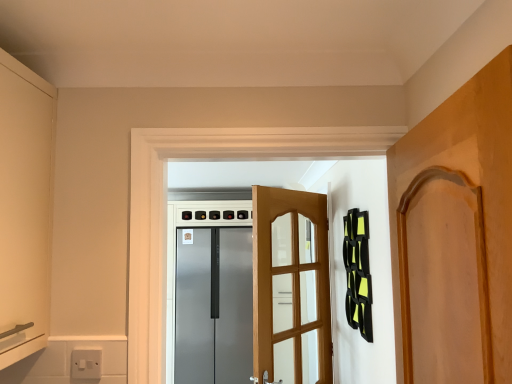
Question: Can you confirm if wooden door at center, positioned as the first door in back-to-front order, is taller than wooden door at right, which appears as the 1th door when viewed from the front?

Choices:
 (A) no
 (B) yes

Answer: (B)

Question: Is wooden door at center, the second door positioned from the front, at the left side of wooden door at right, which appears as the 1th door when viewed from the front?

Choices:
 (A) yes
 (B) no

Answer: (A)

Question: Is wooden door at center, positioned as the first door in back-to-front order, in contact with wooden door at right, the 2th door positioned from the back?

Choices:
 (A) yes
 (B) no

Answer: (B)

Question: Does wooden door at center, the second door positioned from the front, have a lesser width compared to wooden door at right, which appears as the 1th door when viewed from the front?

Choices:
 (A) yes
 (B) no

Answer: (A)

Question: From the image's perspective, is wooden door at center, the second door positioned from the front, beneath wooden door at right, the 2th door positioned from the back?

Choices:
 (A) no
 (B) yes

Answer: (B)

Question: From a real-world perspective, is satin silver refrigerator at center physically located above or below wooden door at right, which appears as the 1th door when viewed from the front?

Choices:
 (A) below
 (B) above

Answer: (A)

Question: Is satin silver refrigerator at center inside or outside of wooden door at right, which appears as the 1th door when viewed from the front?

Choices:
 (A) outside
 (B) inside

Answer: (A)

Question: In terms of width, does satin silver refrigerator at center look wider or thinner when compared to wooden door at right, the 2th door positioned from the back?

Choices:
 (A) wide
 (B) thin

Answer: (A)

Question: Is satin silver refrigerator at center taller or shorter than wooden door at right, which appears as the 1th door when viewed from the front?

Choices:
 (A) tall
 (B) short

Answer: (A)

Question: From a real-world perspective, is white plastic switch at lower left above or below wooden door at right, which appears as the 1th door when viewed from the front?

Choices:
 (A) below
 (B) above

Answer: (A)

Question: In the image, is white plastic switch at lower left positioned in front of or behind wooden door at right, which appears as the 1th door when viewed from the front?

Choices:
 (A) behind
 (B) front

Answer: (A)

Question: In terms of height, does white plastic switch at lower left look taller or shorter compared to wooden door at right, the 2th door positioned from the back?

Choices:
 (A) short
 (B) tall

Answer: (A)

Question: Is white plastic switch at lower left wider or thinner than wooden door at right, the 2th door positioned from the back?

Choices:
 (A) thin
 (B) wide

Answer: (A)

Question: Considering their positions, is wooden door at center, positioned as the first door in back-to-front order, located in front of or behind white plastic switch at lower left?

Choices:
 (A) front
 (B) behind

Answer: (B)

Question: Choose the correct answer: Is wooden door at center, positioned as the first door in back-to-front order, inside white plastic switch at lower left or outside it?

Choices:
 (A) inside
 (B) outside

Answer: (B)